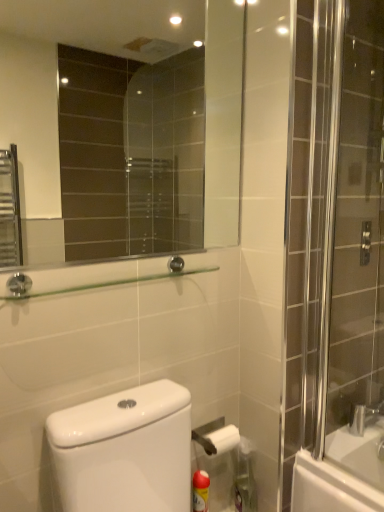
Question: Is yellow matte cleaning product at lower center, placed as the 1th cleaning product when sorted from left to right, facing away from yellow plastic spray can at lower right, positioned as the 1th cleaning product in right-to-left order?

Choices:
 (A) yes
 (B) no

Answer: (B)

Question: Considering the relative sizes of yellow matte cleaning product at lower center, the 2th cleaning product viewed from the right, and yellow plastic spray can at lower right, which is counted as the second cleaning product, starting from the left, in the image provided, is yellow matte cleaning product at lower center, the 2th cleaning product viewed from the right, thinner than yellow plastic spray can at lower right, which is counted as the second cleaning product, starting from the left,?

Choices:
 (A) yes
 (B) no

Answer: (A)

Question: Does yellow matte cleaning product at lower center, placed as the 1th cleaning product when sorted from left to right, turn towards yellow plastic spray can at lower right, positioned as the 1th cleaning product in right-to-left order?

Choices:
 (A) no
 (B) yes

Answer: (A)

Question: Does yellow matte cleaning product at lower center, the 2th cleaning product viewed from the right, have a lesser height compared to yellow plastic spray can at lower right, which is counted as the second cleaning product, starting from the left?

Choices:
 (A) no
 (B) yes

Answer: (B)

Question: Is yellow matte cleaning product at lower center, the 2th cleaning product viewed from the right, smaller than yellow plastic spray can at lower right, positioned as the 1th cleaning product in right-to-left order?

Choices:
 (A) no
 (B) yes

Answer: (B)

Question: From the image's perspective, is yellow matte cleaning product at lower center, placed as the 1th cleaning product when sorted from left to right, on top of yellow plastic spray can at lower right, positioned as the 1th cleaning product in right-to-left order?

Choices:
 (A) no
 (B) yes

Answer: (A)

Question: Does yellow plastic spray can at lower right, which is counted as the second cleaning product, starting from the left, come in front of clear glass shower door at right?

Choices:
 (A) no
 (B) yes

Answer: (A)

Question: Does yellow plastic spray can at lower right, positioned as the 1th cleaning product in right-to-left order, lie behind clear glass shower door at right?

Choices:
 (A) no
 (B) yes

Answer: (B)

Question: Considering the relative sizes of yellow plastic spray can at lower right, which is counted as the second cleaning product, starting from the left, and clear glass shower door at right in the image provided, is yellow plastic spray can at lower right, which is counted as the second cleaning product, starting from the left, wider than clear glass shower door at right?

Choices:
 (A) yes
 (B) no

Answer: (A)

Question: Is yellow plastic spray can at lower right, which is counted as the second cleaning product, starting from the left, far from clear glass shower door at right?

Choices:
 (A) yes
 (B) no

Answer: (B)

Question: Does yellow plastic spray can at lower right, positioned as the 1th cleaning product in right-to-left order, have a greater height compared to clear glass shower door at right?

Choices:
 (A) yes
 (B) no

Answer: (B)

Question: Is yellow plastic spray can at lower right, which is counted as the second cleaning product, starting from the left, oriented away from clear glass shower door at right?

Choices:
 (A) yes
 (B) no

Answer: (B)

Question: From a real-world perspective, is clear glass mirror at upper center positioned under clear glass shower door at right based on gravity?

Choices:
 (A) yes
 (B) no

Answer: (B)